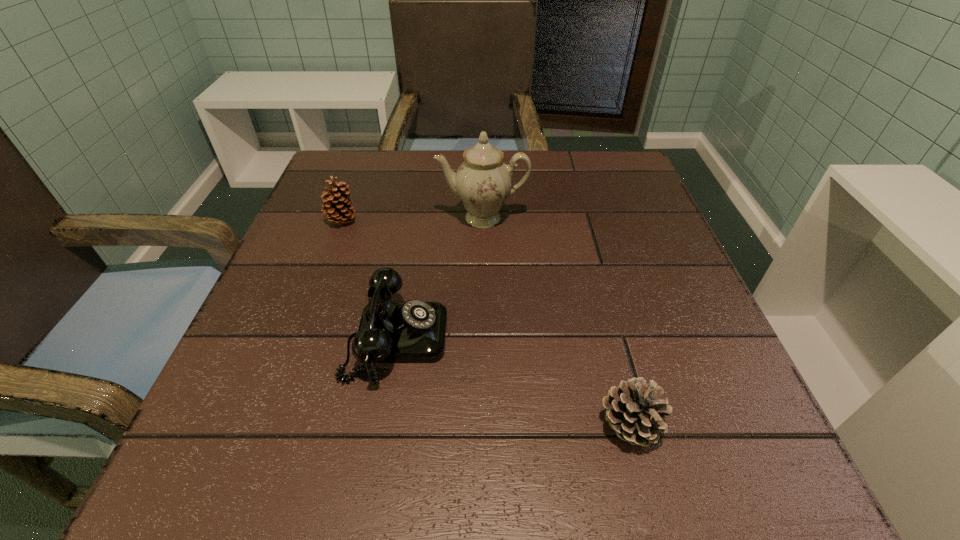
Locate an element on the screen. The image size is (960, 540). the tallest object is located at coordinates (483, 181).

Find the location of a particular element. the left pinecone is located at coordinates click(x=339, y=209).

Find the location of `the leftmost object`. the leftmost object is located at coordinates (339, 209).

Identify the location of the second nearest object. (414, 331).

You are a GUI agent. You are given a task and a screenshot of the screen. Output one action in this format:
    pyautogui.click(x=<x>, y=<y>)
    Task: Click on the right pinecone
    
    Given the screenshot: What is the action you would take?
    pyautogui.click(x=634, y=411)

Image resolution: width=960 pixels, height=540 pixels. I want to click on the shorter pinecone, so click(634, 411).

Identify the location of vacant space located on the spout of the tallest object. Image resolution: width=960 pixels, height=540 pixels. (483, 326).

Where is `free space located 0.270m on the front of the farther pinecone`? The width and height of the screenshot is (960, 540). free space located 0.270m on the front of the farther pinecone is located at coordinates (300, 335).

Locate an element on the screen. free space located 0.190m on the dial of the telephone is located at coordinates (564, 339).

At what (x,y) coordinates should I click in order to perform the action: click on free location located 0.060m on the front of the nearer pinecone. Please return your answer as a coordinate pair (x, y). The image size is (960, 540). Looking at the image, I should click on (650, 504).